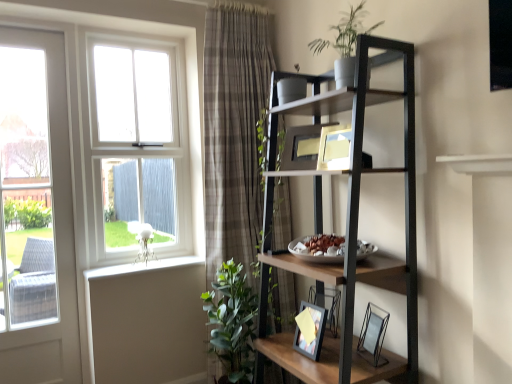
Question: Is the depth of clear glass picture frame at lower right, the second picture frame from the left, less than that of white painted wood at lower left?

Choices:
 (A) yes
 (B) no

Answer: (A)

Question: From a real-world perspective, is clear glass picture frame at lower right, which appears as the first picture frame when ordered from the bottom, positioned under white painted wood at lower left based on gravity?

Choices:
 (A) yes
 (B) no

Answer: (A)

Question: Could you tell me if clear glass picture frame at lower right, the second picture frame in the top-to-bottom sequence, is turned towards white painted wood at lower left?

Choices:
 (A) yes
 (B) no

Answer: (B)

Question: From the image's perspective, does clear glass picture frame at lower right, which appears as the first picture frame when ordered from the bottom, appear lower than white painted wood at lower left?

Choices:
 (A) no
 (B) yes

Answer: (B)

Question: Could white painted wood at lower left be considered to be inside clear glass picture frame at lower right, which ranks as the 2th picture frame in back-to-front order?

Choices:
 (A) no
 (B) yes

Answer: (A)

Question: Is white painted wood at lower left inside the boundaries of green matte plant at upper center, or outside?

Choices:
 (A) outside
 (B) inside

Answer: (A)

Question: In terms of size, does white painted wood at lower left appear bigger or smaller than green matte plant at upper center?

Choices:
 (A) big
 (B) small

Answer: (B)

Question: Is point coord(182,259) closer or farther from the camera than point coord(351,36)?

Choices:
 (A) closer
 (B) farther

Answer: (B)

Question: From the image's perspective, is white painted wood at lower left above or below green matte plant at upper center?

Choices:
 (A) below
 (B) above

Answer: (A)

Question: Is green matte plant at upper center in front of or behind green leafy plant at lower left in the image?

Choices:
 (A) behind
 (B) front

Answer: (B)

Question: From the image's perspective, relative to green leafy plant at lower left, is green matte plant at upper center above or below?

Choices:
 (A) below
 (B) above

Answer: (B)

Question: Which is correct: green matte plant at upper center is inside green leafy plant at lower left, or outside of it?

Choices:
 (A) inside
 (B) outside

Answer: (B)

Question: From a real-world perspective, is green matte plant at upper center positioned above or below green leafy plant at lower left?

Choices:
 (A) above
 (B) below

Answer: (A)

Question: In terms of size, does metallic black shelf at upper right appear bigger or smaller than plaid fabric curtain at center?

Choices:
 (A) big
 (B) small

Answer: (A)

Question: Is point (413, 225) positioned closer to the camera than point (236, 203)?

Choices:
 (A) farther
 (B) closer

Answer: (B)